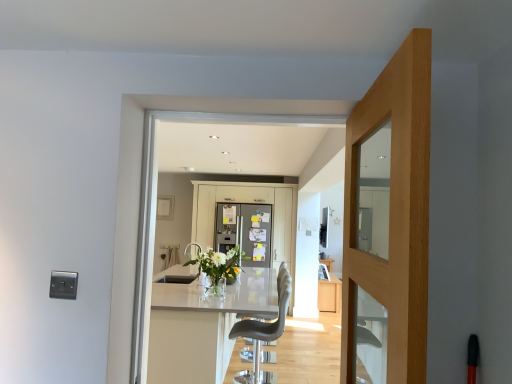
Question: Is clear glass vase at center turned away from matte white cabinet at center?

Choices:
 (A) no
 (B) yes

Answer: (A)

Question: Is clear glass vase at center closer to the viewer compared to matte white cabinet at center?

Choices:
 (A) yes
 (B) no

Answer: (A)

Question: From the image's perspective, is clear glass vase at center under matte white cabinet at center?

Choices:
 (A) yes
 (B) no

Answer: (B)

Question: Considering the relative sizes of clear glass vase at center and matte white cabinet at center in the image provided, is clear glass vase at center bigger than matte white cabinet at center?

Choices:
 (A) no
 (B) yes

Answer: (A)

Question: Is matte white cabinet at center located within clear glass vase at center?

Choices:
 (A) yes
 (B) no

Answer: (B)

Question: Looking at the image, does light oak door at center seem bigger or smaller compared to clear glass vase at center?

Choices:
 (A) big
 (B) small

Answer: (B)

Question: Considering their positions, is light oak door at center located in front of or behind clear glass vase at center?

Choices:
 (A) front
 (B) behind

Answer: (A)

Question: From a real-world perspective, relative to clear glass vase at center, is light oak door at center vertically above or below?

Choices:
 (A) above
 (B) below

Answer: (A)

Question: From the image's perspective, is light oak door at center positioned above or below clear glass vase at center?

Choices:
 (A) above
 (B) below

Answer: (A)

Question: Would you say clear glass vase at center is inside or outside light oak door at center?

Choices:
 (A) outside
 (B) inside

Answer: (A)

Question: Looking at the image, does clear glass vase at center seem bigger or smaller compared to light oak door at center?

Choices:
 (A) small
 (B) big

Answer: (B)

Question: Is point (200, 259) closer or farther from the camera than point (373, 109)?

Choices:
 (A) closer
 (B) farther

Answer: (B)

Question: In terms of width, does clear glass vase at center look wider or thinner when compared to light oak door at center?

Choices:
 (A) thin
 (B) wide

Answer: (B)

Question: Is clear glass vase at center bigger or smaller than matte white cabinet at center?

Choices:
 (A) small
 (B) big

Answer: (A)

Question: From the image's perspective, is clear glass vase at center located above or below matte white cabinet at center?

Choices:
 (A) below
 (B) above

Answer: (B)